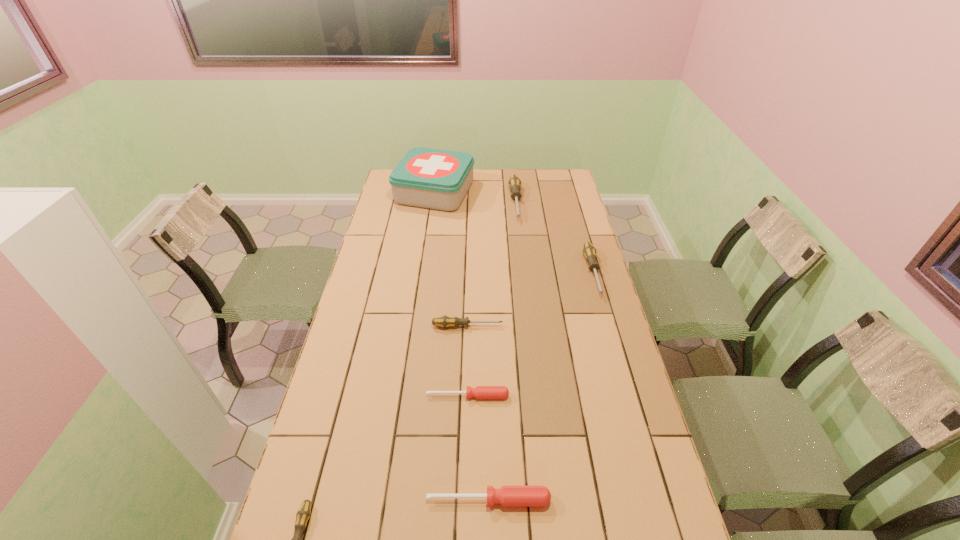
You are a GUI agent. You are given a task and a screenshot of the screen. Output one action in this format:
    pyautogui.click(x=<x>, y=<y>)
    Task: Click on the blank area in the image that satisfies the following two spatial constraints: 1. at the tip of the third gray screwdriver from right to left; 2. on the right side of the nearer red screwdriver
    The width and height of the screenshot is (960, 540).
    Given the screenshot: What is the action you would take?
    pyautogui.click(x=463, y=500)

Locate an element on the screen. vacant point that satisfies the following two spatial constraints: 1. at the tip of the farther red screwdriver; 2. on the left side of the third farthest screwdriver is located at coordinates (466, 396).